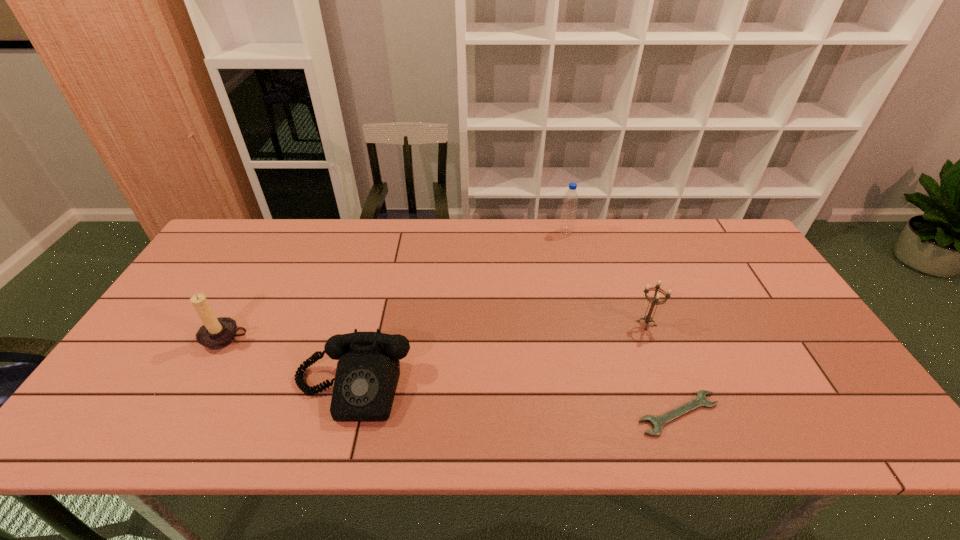
The height and width of the screenshot is (540, 960). Find the location of `free space at the far right corner`. free space at the far right corner is located at coordinates (685, 224).

Find the location of `vacant space that is in between the wrench and the farthest object`. vacant space that is in between the wrench and the farthest object is located at coordinates (622, 323).

At what (x,y) coordinates should I click in order to perform the action: click on vacant space that's between the telephone and the right candle holder. Please return your answer as a coordinate pair (x, y). This screenshot has height=540, width=960. Looking at the image, I should click on (499, 356).

The image size is (960, 540). What are the coordinates of `vacant area that lies between the wrench and the left candle holder` in the screenshot? It's located at (452, 376).

Locate an element on the screen. Image resolution: width=960 pixels, height=540 pixels. free point between the telephone and the shorter candle holder is located at coordinates (499, 356).

Where is `vacant area that lies between the telephone and the third object from right to left`? The height and width of the screenshot is (540, 960). vacant area that lies between the telephone and the third object from right to left is located at coordinates (459, 310).

The height and width of the screenshot is (540, 960). Identify the location of free space that is in between the shorter candle holder and the third object from left to right. (606, 278).

You are a GUI agent. You are given a task and a screenshot of the screen. Output one action in this format:
    pyautogui.click(x=<x>, y=<y>)
    Task: Click on the vacant area that lies between the taller candle holder and the right candle holder
    The height and width of the screenshot is (540, 960).
    Given the screenshot: What is the action you would take?
    pyautogui.click(x=437, y=331)

Image resolution: width=960 pixels, height=540 pixels. I want to click on blank region between the right candle holder and the left candle holder, so (x=437, y=331).

This screenshot has height=540, width=960. I want to click on vacant region between the water bottle and the right candle holder, so click(x=606, y=278).